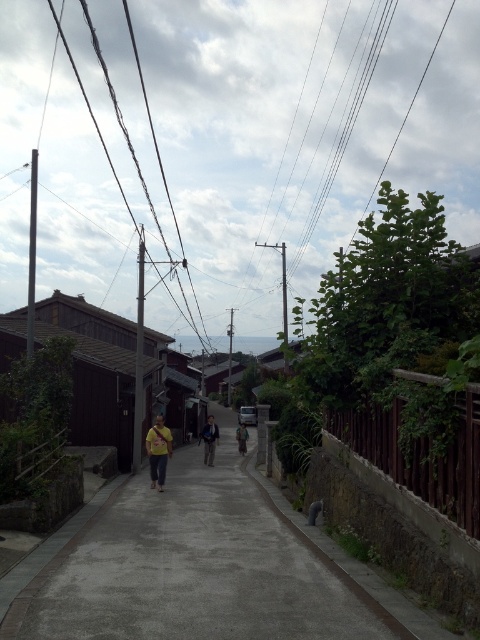
You are a delivery person trying to navigate through the narrow street. You notice a black wire at upper center and a yellow fabric shirt at center. Which object is higher up in the scene?

The black wire at upper center is taller than the yellow fabric shirt at center in the scene.

You are a delivery person trying to place a package on the gray concrete pavement at center. The package is 2 inches tall. Can you place it there without it being hidden by the yellow fabric at center?

The gray concrete pavement at center has a lesser height compared to yellow fabric at center. Since the package is only 2 inches tall, it might still be visible as the pavement is lower, but the yellow fabric could potentially block the view depending on its exact position and angle.